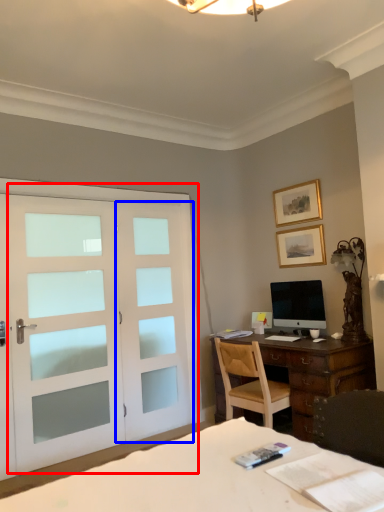
Question: Which of the following is the closest to the observer, door (highlighted by a red box) or screen door (highlighted by a blue box)?

Choices:
 (A) door
 (B) screen door

Answer: (A)